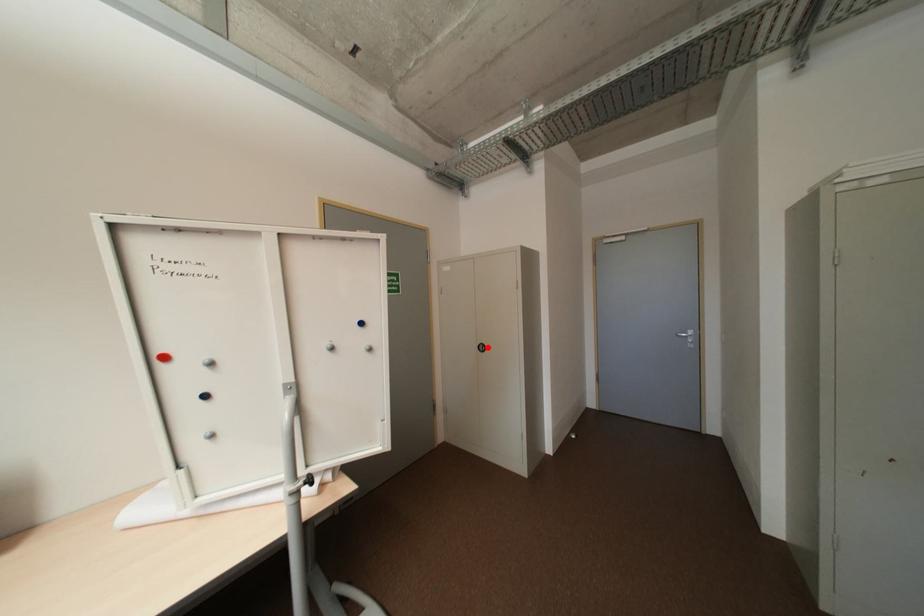
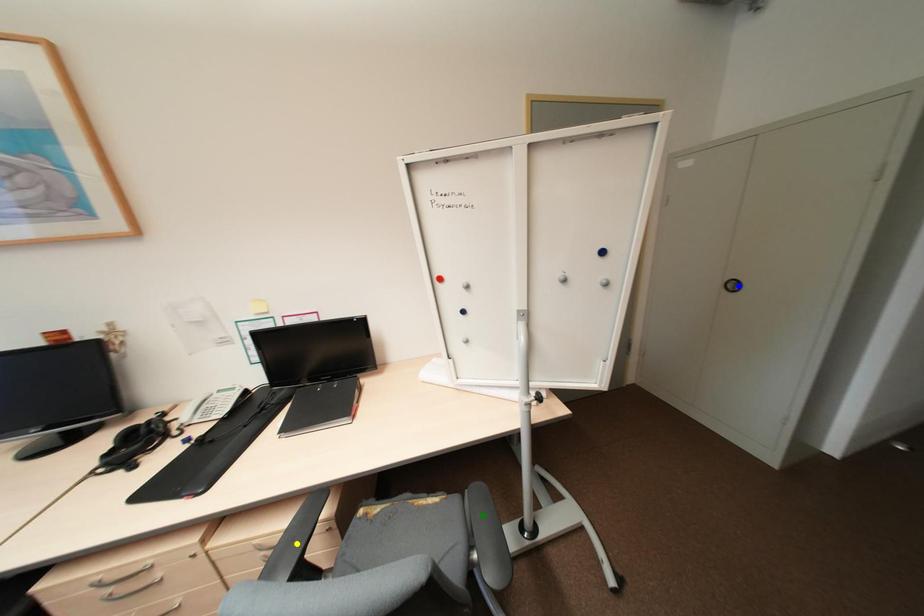
Question: I am providing you with two images of the same scene from different viewpoints. A red point is marked on the first image. You are given multiple points on the second image. Can you choose the point in image 2 that corresponds to the point in image 1?

Choices:
 (A) blue point
 (B) green point
 (C) yellow point

Answer: (A)